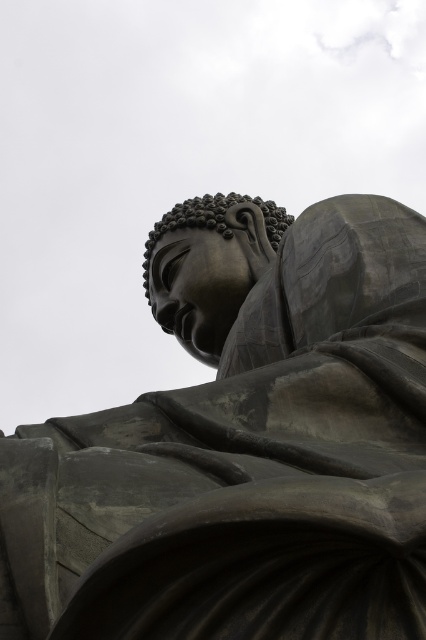
Question: Can you confirm if bronze statue at center is positioned below matte bronze head at center?

Choices:
 (A) no
 (B) yes

Answer: (B)

Question: Which point is farther from the camera taking this photo?

Choices:
 (A) (5, 481)
 (B) (218, 310)

Answer: (B)

Question: Can you confirm if bronze statue at center is wider than matte bronze head at center?

Choices:
 (A) yes
 (B) no

Answer: (A)

Question: Where is bronze statue at center located in relation to matte bronze head at center in the image?

Choices:
 (A) below
 (B) above

Answer: (A)

Question: Which of the following is the closest to the observer?

Choices:
 (A) (224, 308)
 (B) (279, 493)

Answer: (B)